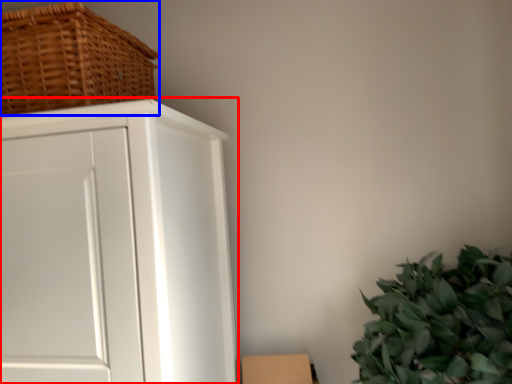
Question: Among these objects, which one is nearest to the camera, cupboard (highlighted by a red box) or basket (highlighted by a blue box)?

Choices:
 (A) cupboard
 (B) basket

Answer: (A)